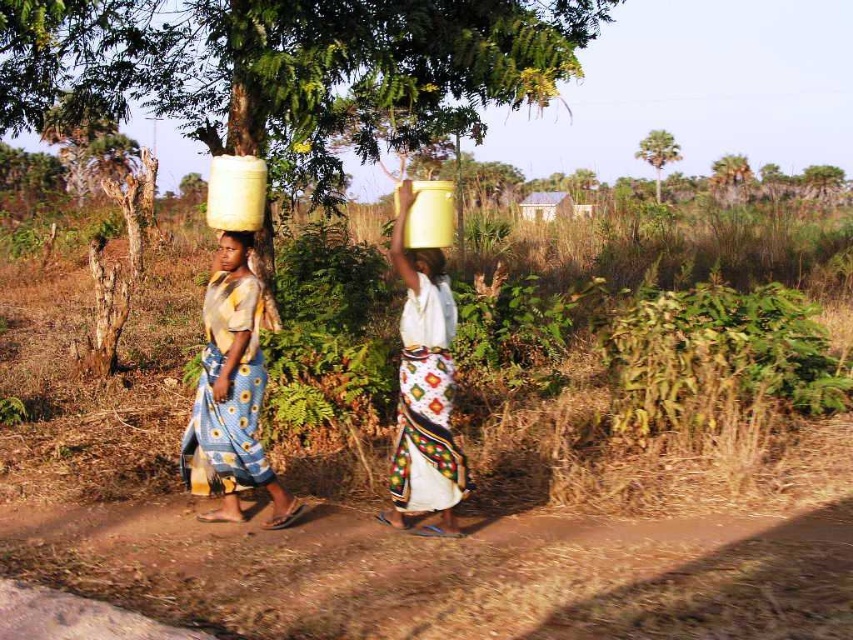
Question: Which point is closer to the camera?

Choices:
 (A) smooth skin face at center
 (B) blue printed fabric skirt at left
 (C) matte yellow container at center
 (D) yellow matte water bucket at upper center

Answer: (D)

Question: Does smooth skin face at center have a larger size compared to matte yellow container at center?

Choices:
 (A) no
 (B) yes

Answer: (B)

Question: Can you confirm if blue printed fabric skirt at left is thinner than smooth skin face at center?

Choices:
 (A) no
 (B) yes

Answer: (A)

Question: Which point appears farthest from the camera in this image?

Choices:
 (A) pyautogui.click(x=444, y=515)
 (B) pyautogui.click(x=218, y=436)
 (C) pyautogui.click(x=213, y=257)

Answer: (C)

Question: Among these points, which one is farthest from the camera?

Choices:
 (A) (241, 237)
 (B) (241, 484)

Answer: (B)

Question: Is yellow matte water bucket at upper center thinner than matte yellow container at center?

Choices:
 (A) no
 (B) yes

Answer: (A)